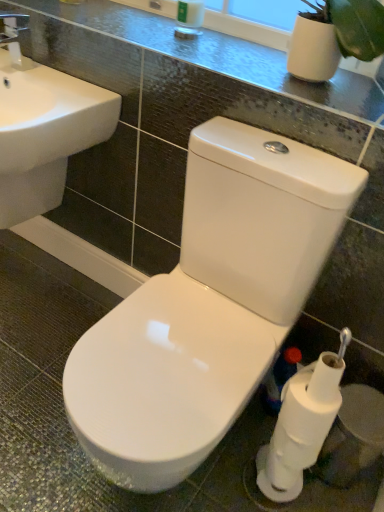
Question: Could you tell me if white matte toilet paper at lower right, which is counted as the 1th toilet paper, starting from the bottom, is facing white matte toilet paper at lower right, the 2th toilet paper positioned from the bottom?

Choices:
 (A) no
 (B) yes

Answer: (A)

Question: From the image's perspective, is white matte toilet paper at lower right, which is counted as the 1th toilet paper, starting from the bottom, under white matte toilet paper at lower right, the 1th toilet paper viewed from the top?

Choices:
 (A) yes
 (B) no

Answer: (A)

Question: Is white matte toilet paper at lower right, the 1th toilet paper viewed from the top, at the back of white matte toilet paper at lower right, which is counted as the 1th toilet paper, starting from the bottom?

Choices:
 (A) no
 (B) yes

Answer: (A)

Question: From a real-world perspective, is white matte toilet paper at lower right, which is counted as the second toilet paper, starting from the top, physically below white matte toilet paper at lower right, the 2th toilet paper positioned from the bottom?

Choices:
 (A) no
 (B) yes

Answer: (B)

Question: Is white matte toilet paper at lower right, which is counted as the second toilet paper, starting from the top, in front of white matte toilet paper at lower right, the 1th toilet paper viewed from the top?

Choices:
 (A) no
 (B) yes

Answer: (A)

Question: From a real-world perspective, is white matte toilet paper at lower right, the 1th toilet paper viewed from the top, physically located above or below white ceramic sink at left?

Choices:
 (A) above
 (B) below

Answer: (B)

Question: Considering the positions of white matte toilet paper at lower right, the 2th toilet paper positioned from the bottom, and white ceramic sink at left in the image, is white matte toilet paper at lower right, the 2th toilet paper positioned from the bottom, bigger or smaller than white ceramic sink at left?

Choices:
 (A) big
 (B) small

Answer: (B)

Question: From the image's perspective, is white matte toilet paper at lower right, the 1th toilet paper viewed from the top, located above or below white ceramic sink at left?

Choices:
 (A) below
 (B) above

Answer: (A)

Question: Visually, is white matte toilet paper at lower right, the 2th toilet paper positioned from the bottom, positioned to the left or to the right of white ceramic sink at left?

Choices:
 (A) right
 (B) left

Answer: (A)

Question: Based on their positions, is white glossy toilet at center located to the left or right of glossy ceramic counter top at upper center?

Choices:
 (A) left
 (B) right

Answer: (B)

Question: Considering their positions, is white glossy toilet at center located in front of or behind glossy ceramic counter top at upper center?

Choices:
 (A) behind
 (B) front

Answer: (B)

Question: From the image's perspective, is white glossy toilet at center positioned above or below glossy ceramic counter top at upper center?

Choices:
 (A) below
 (B) above

Answer: (A)

Question: Does point (349, 180) appear closer or farther from the camera than point (258, 58)?

Choices:
 (A) farther
 (B) closer

Answer: (B)

Question: From a real-world perspective, relative to white glossy toilet at center, is glossy ceramic counter top at upper center vertically above or below?

Choices:
 (A) above
 (B) below

Answer: (A)

Question: Considering the positions of glossy ceramic counter top at upper center and white glossy toilet at center in the image, is glossy ceramic counter top at upper center taller or shorter than white glossy toilet at center?

Choices:
 (A) tall
 (B) short

Answer: (B)